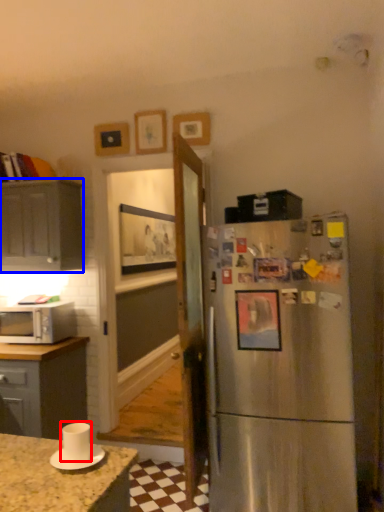
Question: Among these objects, which one is farthest to the camera, appliance (highlighted by a red box) or cabinetry (highlighted by a blue box)?

Choices:
 (A) appliance
 (B) cabinetry

Answer: (B)